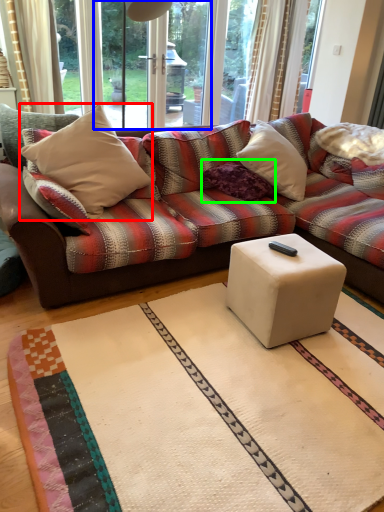
Question: Which object is positioned closest to throw pillow (highlighted by a red box)? Select from screen door (highlighted by a blue box) and pillow (highlighted by a green box).

Choices:
 (A) screen door
 (B) pillow

Answer: (B)